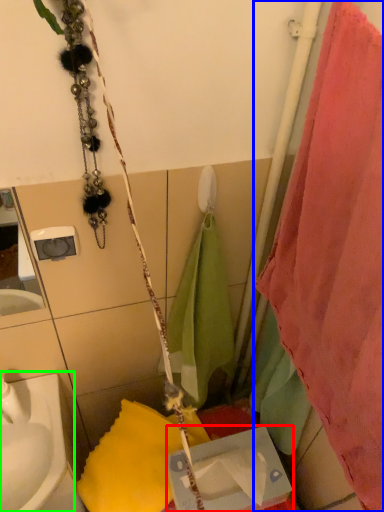
Question: Considering the real-world distances, which object is farthest from box (highlighted by a red box)? curtain (highlighted by a blue box) or sink (highlighted by a green box)?

Choices:
 (A) curtain
 (B) sink

Answer: (A)